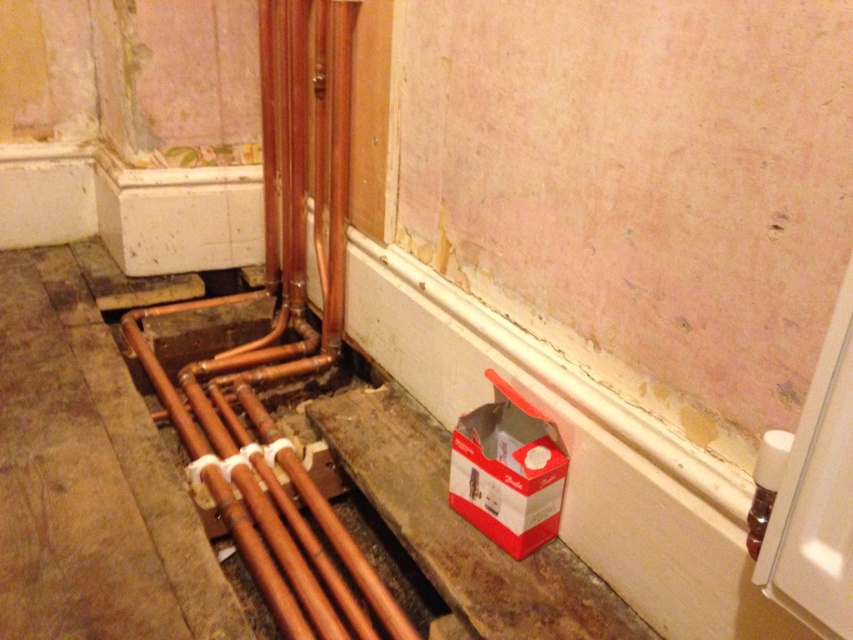
You are a contractor inspecting the renovation site. You notice the copper pipes at lower left and the red cardboard box at lower right. Which object is positioned lower in the image?

The copper pipes at lower left are positioned lower than the red cardboard box at lower right in the image.

You are a contractor assessing the renovation site. You notice the copper pipes at lower left and the red cardboard box at lower right. Which object is bigger in size?

The copper pipes at lower left has a larger size compared to the red cardboard box at lower right.

You are a contractor working in this room. You need to place a tool box that is 20 inches long between the copper pipes at lower left and the red cardboard box at lower right. Will there be enough space?

The copper pipes at lower left is 18.36 inches from red cardboard box at lower right. Since the tool box is 20 inches long, it will not fit in the available space.